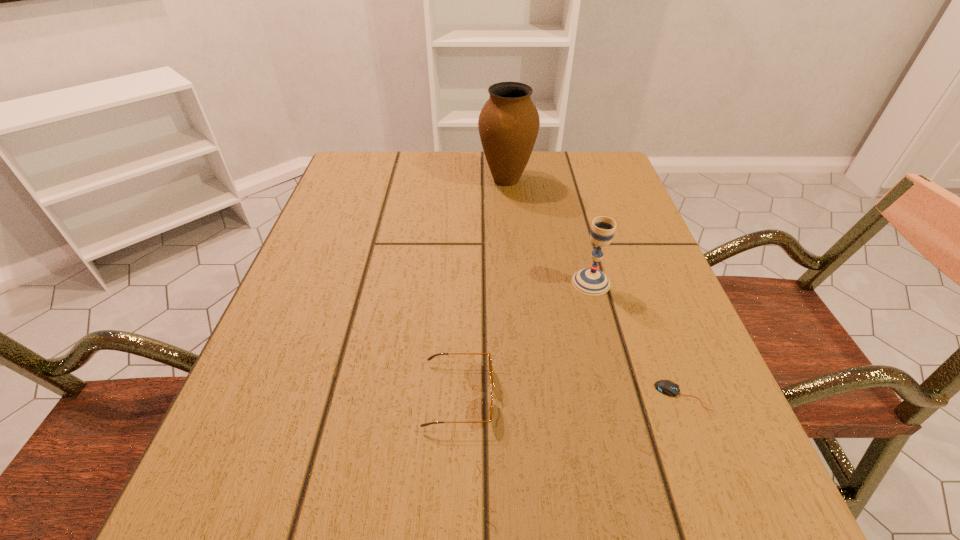
Locate an element on the screen. This screenshot has height=540, width=960. vacant space that satisfies the following two spatial constraints: 1. on the lenses of the mouse; 2. on the left side of the sunglasses is located at coordinates (459, 396).

Locate an element on the screen. This screenshot has height=540, width=960. vacant space that satisfies the following two spatial constraints: 1. on the lenses of the third tallest object; 2. on the back side of the mouse is located at coordinates (459, 396).

Find the location of a particular element. The width and height of the screenshot is (960, 540). vacant region that satisfies the following two spatial constraints: 1. on the front side of the third shortest object; 2. on the left side of the shortest object is located at coordinates (621, 396).

You are a GUI agent. You are given a task and a screenshot of the screen. Output one action in this format:
    pyautogui.click(x=<x>, y=<y>)
    Task: Click on the free space in the image that satisfies the following two spatial constraints: 1. on the front side of the urn; 2. on the lenses of the sunglasses
    The height and width of the screenshot is (540, 960).
    Given the screenshot: What is the action you would take?
    pyautogui.click(x=524, y=395)